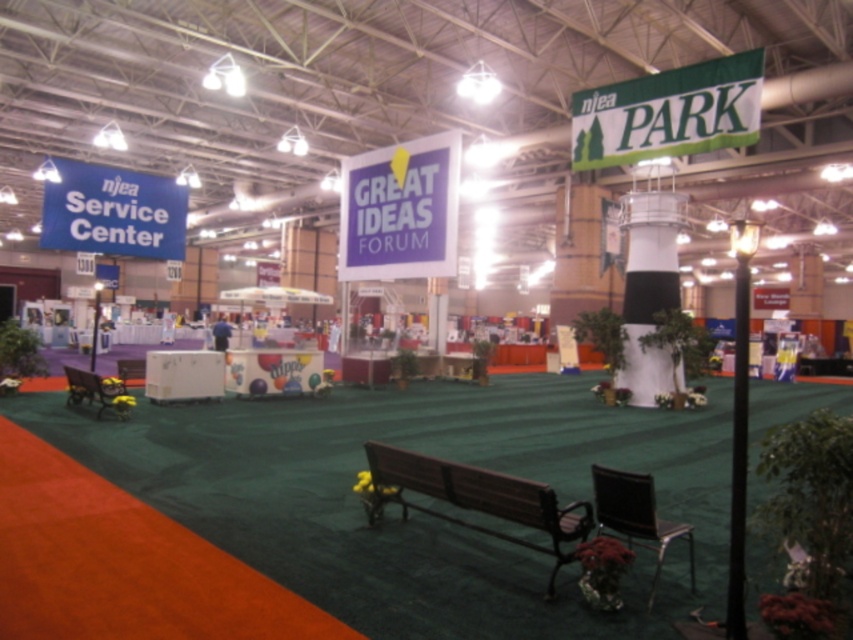
Is point (659, 570) positioned in front of point (94, 394)?

Yes, it is in front of point (94, 394).

Who is more forward, (595,506) or (77,401)?

Point (595,506) is in front.

Identify the location of brown leather bench at lower center. This screenshot has height=640, width=853. (636, 515).

Which of these two, purple paper sign at center or wooden park bench at left, stands taller?

With more height is purple paper sign at center.

Consider the image. Between purple paper sign at center and wooden park bench at left, which one is positioned lower?

wooden park bench at left is lower down.

Find the location of `purple paper sign at center`. purple paper sign at center is located at coordinates pyautogui.click(x=399, y=211).

Find the location of a particular element. purple paper sign at center is located at coordinates (399, 211).

Is point (384, 204) positioned before point (381, 484)?

No, (384, 204) is further to viewer.

Is point (456, 138) farther from viewer compared to point (381, 465)?

Yes, point (456, 138) is farther from viewer.

Between point (425, 205) and point (407, 458), which one is positioned behind?

Point (425, 205)

Where is `purple paper sign at center`? Image resolution: width=853 pixels, height=640 pixels. purple paper sign at center is located at coordinates (399, 211).